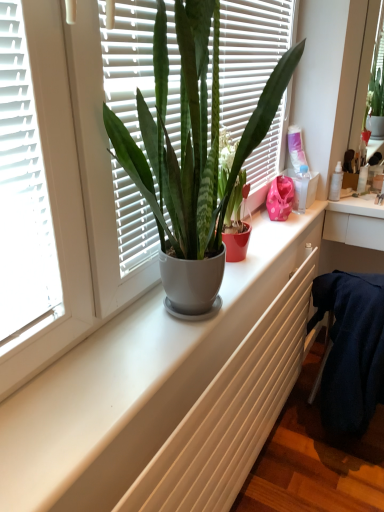
Question: Is transparent plastic bottle at upper right wider or thinner than white matte radiator at center?

Choices:
 (A) thin
 (B) wide

Answer: (A)

Question: Does point (312, 199) appear closer or farther from the camera than point (120, 499)?

Choices:
 (A) closer
 (B) farther

Answer: (B)

Question: Estimate the real-world distances between objects in this image. Which object is farther from the white matte radiator at center?

Choices:
 (A) matte white pot at center
 (B) transparent plastic bottle at upper right

Answer: (B)

Question: Which object is positioned farthest from the white matte radiator at center?

Choices:
 (A) matte white pot at center
 (B) transparent plastic bottle at upper right

Answer: (B)